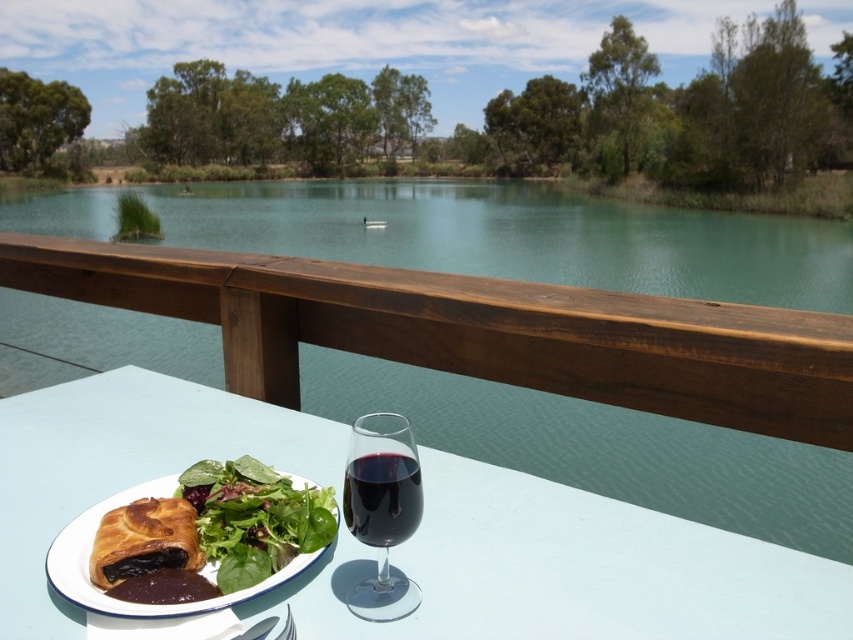
You are a guest at this lakeside table and want to reach for the transparent glass at center without disturbing the clear water at table center. Which object should you approach first based on their positions?

The transparent glass at center is closer to you than the clear water at table center, so you should reach for the transparent glass at center first to avoid disturbing the clear water at table center which is further away.

Based on the photo, you are setting up a picnic and want to place a large blanket on the white glossy table at lower center. Considering the size of the green leafy salad at center, will the blanket fit comfortably on the table?

The white glossy table at lower center is wider than the green leafy salad at center, so the blanket should fit comfortably as the table has more width available.

You are a server at an outdoor dining event. You have to place a 12.5 inch wide decorative plate between the clear water at table center and the transparent glass at center. Can you fit it there without moving either object?

The distance between the clear water at table center and the transparent glass at center is 30.63 inches. Since the decorative plate is 12.5 inches wide, there is enough space to place it between them without moving either object.